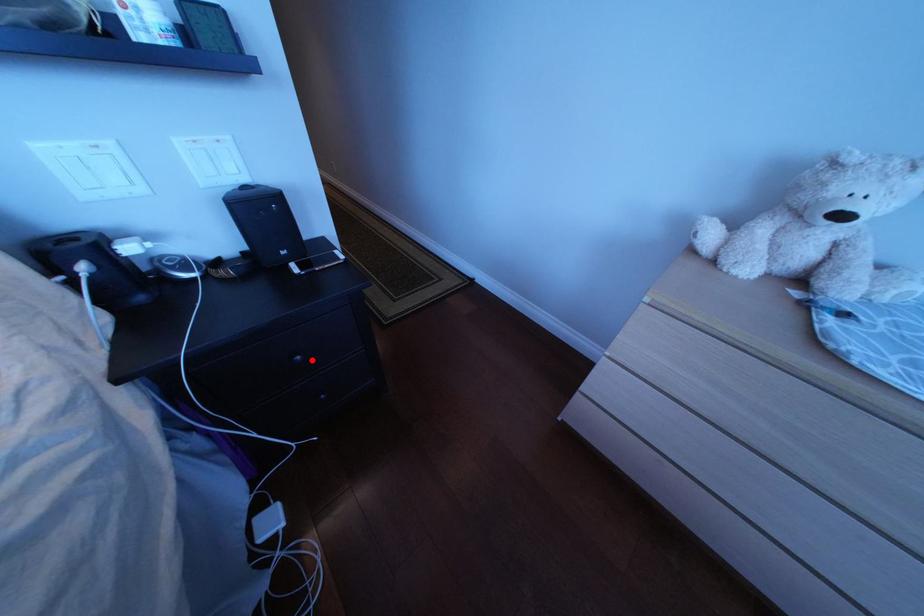
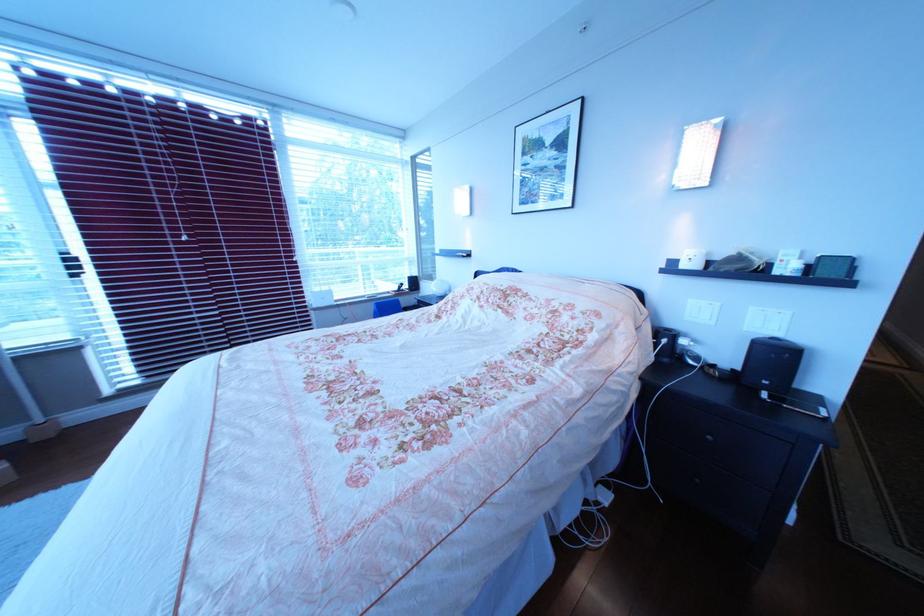
Question: I am providing you with two images of the same scene from different viewpoints. In image1, a red point is highlighted. Considering the same 3D point in image2, which of the following is correct?

Choices:
 (A) It is closer
 (B) It is farther

Answer: (B)